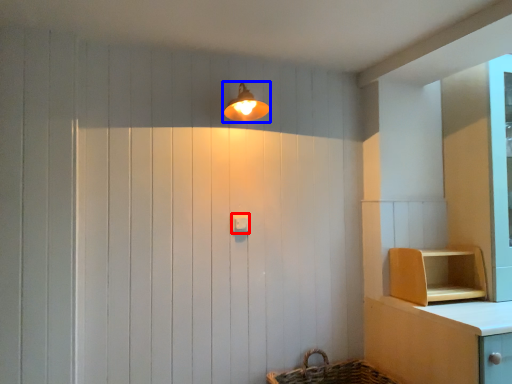
Question: Which object appears farthest to the camera in this image, light switch (highlighted by a red box) or light fixture (highlighted by a blue box)?

Choices:
 (A) light switch
 (B) light fixture

Answer: (A)